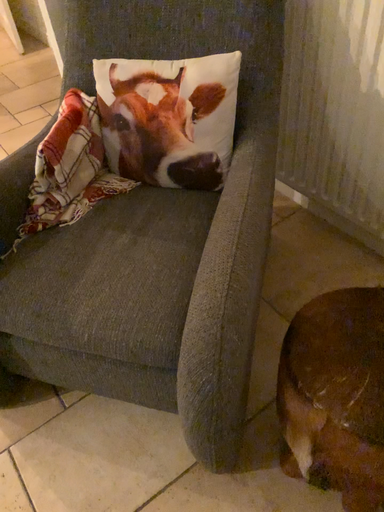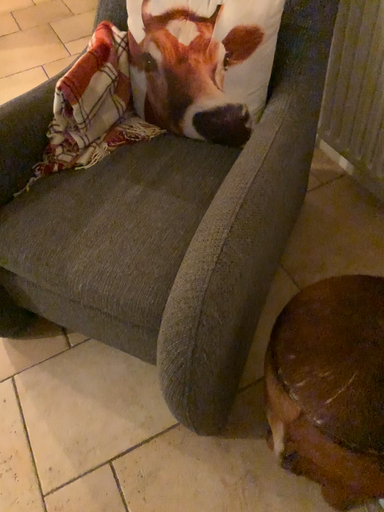
Question: How did the camera likely rotate when shooting the video?

Choices:
 (A) rotated right
 (B) rotated left

Answer: (B)